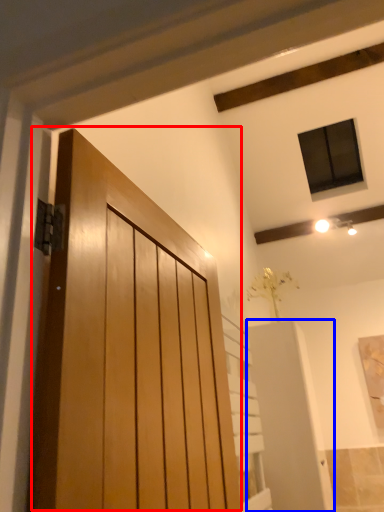
Question: Which object is further to the camera taking this photo, door (highlighted by a red box) or elevator (highlighted by a blue box)?

Choices:
 (A) door
 (B) elevator

Answer: (B)